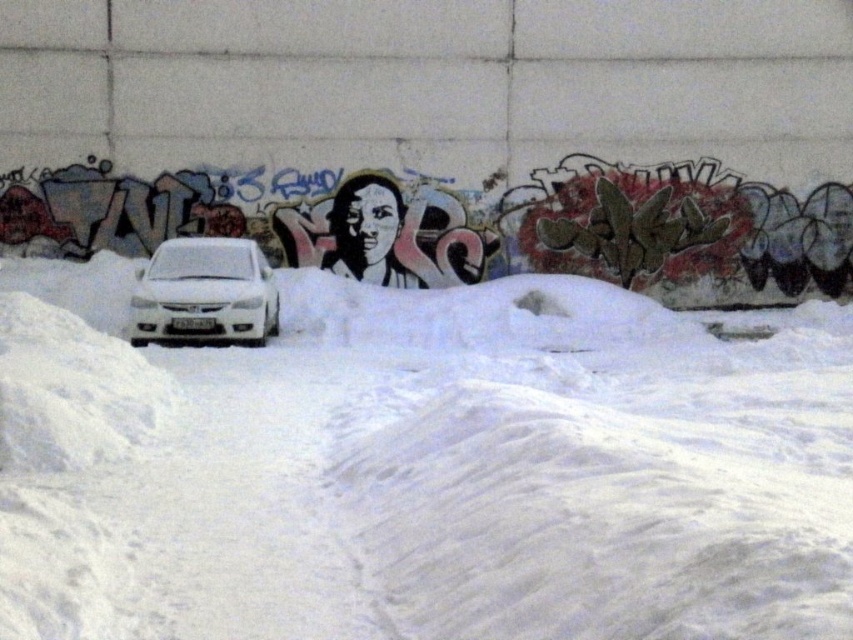
Question: Which object is farther from the camera taking this photo?

Choices:
 (A) white glossy car at center
 (B) white fluffy snow at center

Answer: (A)

Question: In this image, where is white fluffy snow at center located relative to white glossy car at center?

Choices:
 (A) left
 (B) right

Answer: (B)

Question: Is white fluffy snow at center behind white glossy car at center?

Choices:
 (A) no
 (B) yes

Answer: (A)

Question: Is white fluffy snow at center positioned at the back of white glossy car at center?

Choices:
 (A) no
 (B) yes

Answer: (A)